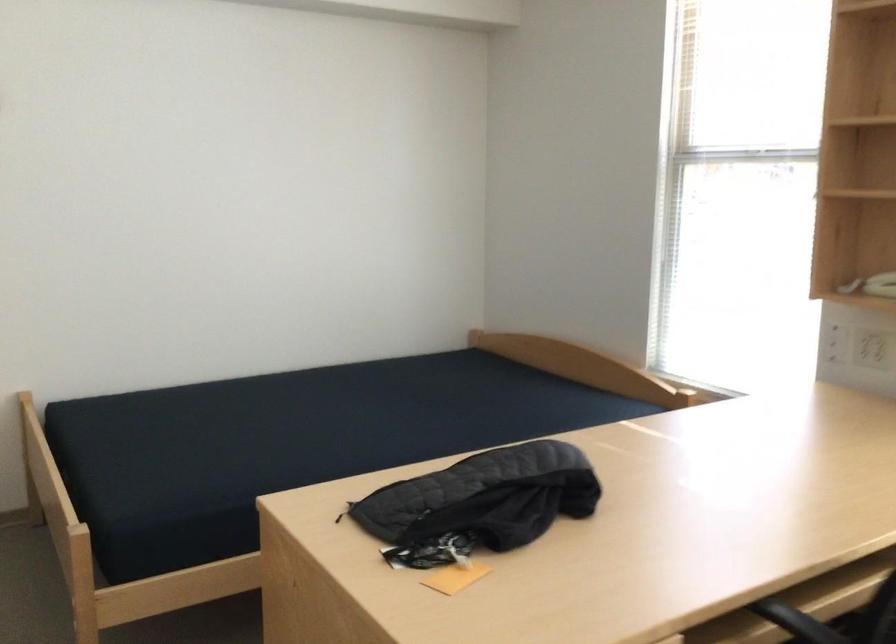
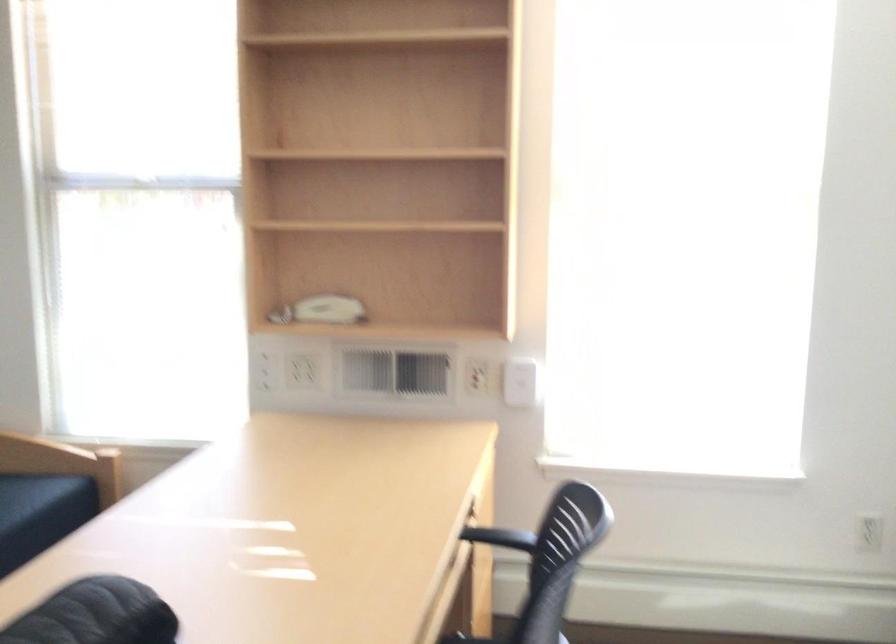
Question: The images are taken continuously from a first-person perspective. In which direction is your viewpoint rotating?

Choices:
 (A) Left
 (B) Right
 (C) Up
 (D) Down

Answer: (B)